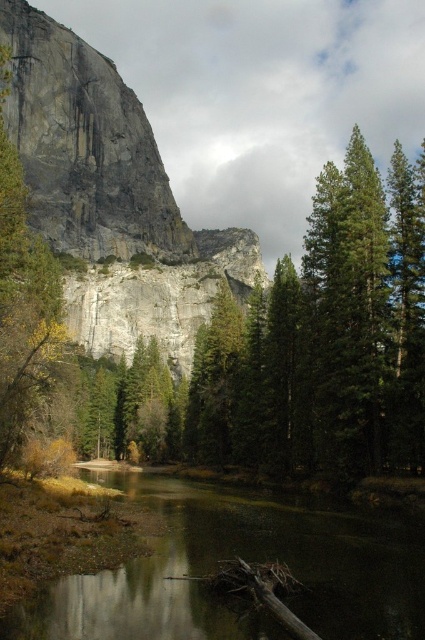
Question: Can you confirm if green smooth water at center is positioned to the right of green matte tree at left?

Choices:
 (A) yes
 (B) no

Answer: (A)

Question: Which of the following is the farthest from the observer?

Choices:
 (A) gray rock cliff at upper center
 (B) green smooth water at center

Answer: (A)

Question: Is gray rock cliff at upper center bigger than green smooth water at center?

Choices:
 (A) no
 (B) yes

Answer: (B)

Question: Which point is closer to the camera?

Choices:
 (A) (31, 384)
 (B) (78, 582)

Answer: (B)

Question: Is the position of green smooth water at center more distant than that of green matte tree at left?

Choices:
 (A) no
 (B) yes

Answer: (A)

Question: Which of the following is the farthest from the observer?

Choices:
 (A) green smooth water at center
 (B) green matte tree at left
 (C) gray rock cliff at upper center

Answer: (C)